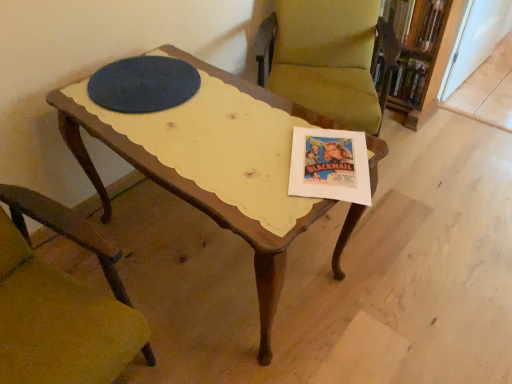
Question: From a real-world perspective, is wooden chair at lower left, marked as the 2th chair in a right-to-left arrangement, over wooden bookcase at upper right?

Choices:
 (A) yes
 (B) no

Answer: (A)

Question: From a real-world perspective, is wooden chair at lower left, arranged as the 1th chair when viewed from the left, below wooden bookcase at upper right?

Choices:
 (A) no
 (B) yes

Answer: (A)

Question: Considering the relative sizes of wooden chair at lower left, the first chair ordered from the bottom, and wooden bookcase at upper right in the image provided, is wooden chair at lower left, the first chair ordered from the bottom, thinner than wooden bookcase at upper right?

Choices:
 (A) no
 (B) yes

Answer: (A)

Question: Is wooden chair at lower left, marked as the 2th chair in a right-to-left arrangement, looking in the opposite direction of wooden bookcase at upper right?

Choices:
 (A) no
 (B) yes

Answer: (A)

Question: Considering the relative sizes of wooden chair at lower left, marked as the 2th chair in a right-to-left arrangement, and wooden bookcase at upper right in the image provided, is wooden chair at lower left, marked as the 2th chair in a right-to-left arrangement, shorter than wooden bookcase at upper right?

Choices:
 (A) yes
 (B) no

Answer: (B)

Question: From the image's perspective, is wooden chair at lower left, the 2th chair viewed from the top, beneath wooden bookcase at upper right?

Choices:
 (A) no
 (B) yes

Answer: (B)

Question: Is wooden chair at lower left, marked as the 2th chair in a right-to-left arrangement, oriented away from velvet green chair at center, positioned as the 1th chair in top-to-bottom order?

Choices:
 (A) no
 (B) yes

Answer: (A)

Question: Considering the relative sizes of wooden chair at lower left, the 2th chair viewed from the top, and velvet green chair at center, which is the 2th chair from bottom to top, in the image provided, is wooden chair at lower left, the 2th chair viewed from the top, bigger than velvet green chair at center, which is the 2th chair from bottom to top,?

Choices:
 (A) yes
 (B) no

Answer: (B)

Question: Is velvet green chair at center, which appears as the first chair when viewed from the right, completely or partially inside wooden chair at lower left, the 2th chair viewed from the back?

Choices:
 (A) no
 (B) yes

Answer: (A)

Question: Is the depth of wooden chair at lower left, the 2th chair viewed from the back, less than that of velvet green chair at center, the 1th chair in the back-to-front sequence?

Choices:
 (A) no
 (B) yes

Answer: (B)

Question: Is wooden chair at lower left, the 2th chair viewed from the back, positioned far away from velvet green chair at center, positioned as the 1th chair in top-to-bottom order?

Choices:
 (A) yes
 (B) no

Answer: (A)

Question: Considering the relative sizes of wooden chair at lower left, the 2th chair viewed from the back, and velvet green chair at center, the 2th chair viewed from the front, in the image provided, is wooden chair at lower left, the 2th chair viewed from the back, thinner than velvet green chair at center, the 2th chair viewed from the front,?

Choices:
 (A) no
 (B) yes

Answer: (B)

Question: From a real-world perspective, is wooden bookcase at upper right on hardcover book at upper right?

Choices:
 (A) yes
 (B) no

Answer: (B)